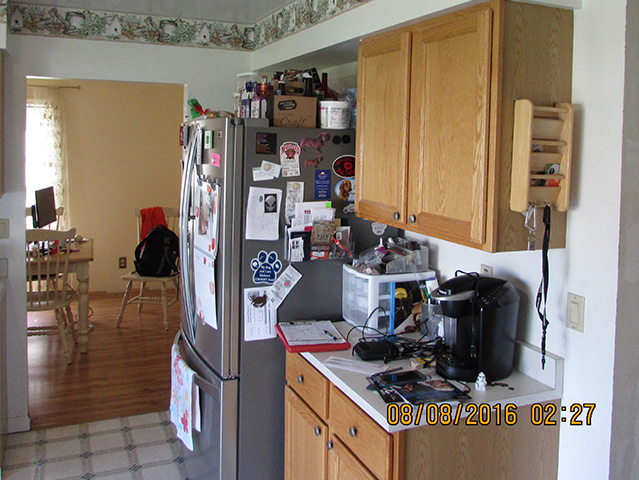
Where is `drawer`? drawer is located at coordinates (316, 392), (341, 409).